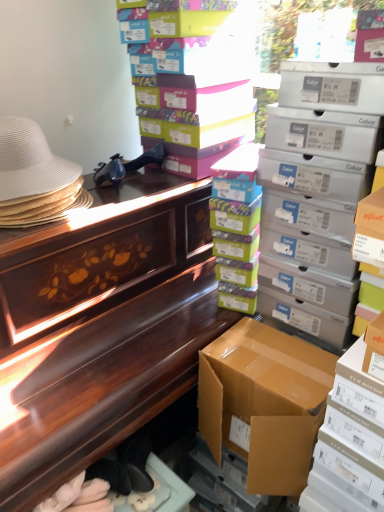
Question: Does multicolored cardboard boxes at center, the 3th box positioned from the top, have a lesser width compared to brown cardboard box at lower right, positioned as the fourth box in top-to-bottom order?

Choices:
 (A) yes
 (B) no

Answer: (A)

Question: From a real-world perspective, is multicolored cardboard boxes at center, the 3th box positioned from the top, over brown cardboard box at lower right, positioned as the fourth box in top-to-bottom order?

Choices:
 (A) no
 (B) yes

Answer: (B)

Question: Would you say multicolored cardboard boxes at center, acting as the 3th box starting from the bottom, is a long distance from brown cardboard box at lower right, positioned as the fourth box in top-to-bottom order?

Choices:
 (A) no
 (B) yes

Answer: (A)

Question: Does multicolored cardboard boxes at center, acting as the 3th box starting from the bottom, have a greater height compared to brown cardboard box at lower right, positioned as the fourth box in top-to-bottom order?

Choices:
 (A) no
 (B) yes

Answer: (B)

Question: Is brown cardboard box at lower right, the 2th box in the bottom-to-top sequence, inside multicolored cardboard boxes at center, acting as the 3th box starting from the bottom?

Choices:
 (A) yes
 (B) no

Answer: (B)

Question: Can you confirm if multicolored cardboard boxes at center, the 3th box positioned from the top, is positioned to the left of brown cardboard box at lower right, the 2th box in the bottom-to-top sequence?

Choices:
 (A) no
 (B) yes

Answer: (B)

Question: Considering the relative sizes of matte cardboard box at upper right, marked as the second box in a top-to-bottom arrangement, and multicolored cardboard boxes at center, acting as the 3th box starting from the bottom, in the image provided, is matte cardboard box at upper right, marked as the second box in a top-to-bottom arrangement, thinner than multicolored cardboard boxes at center, acting as the 3th box starting from the bottom,?

Choices:
 (A) yes
 (B) no

Answer: (B)

Question: Considering the relative positions of matte cardboard box at upper right, which is counted as the 4th box, starting from the bottom, and multicolored cardboard boxes at center, the 3th box positioned from the top, in the image provided, is matte cardboard box at upper right, which is counted as the 4th box, starting from the bottom, to the right of multicolored cardboard boxes at center, the 3th box positioned from the top, from the viewer's perspective?

Choices:
 (A) yes
 (B) no

Answer: (A)

Question: From the image's perspective, is matte cardboard box at upper right, marked as the second box in a top-to-bottom arrangement, above multicolored cardboard boxes at center, the 3th box positioned from the top?

Choices:
 (A) no
 (B) yes

Answer: (B)

Question: Can you confirm if matte cardboard box at upper right, marked as the second box in a top-to-bottom arrangement, is wider than multicolored cardboard boxes at center, the 3th box positioned from the top?

Choices:
 (A) yes
 (B) no

Answer: (A)

Question: From the image's perspective, is matte cardboard box at upper right, which is counted as the 4th box, starting from the bottom, below multicolored cardboard boxes at center, acting as the 3th box starting from the bottom?

Choices:
 (A) no
 (B) yes

Answer: (A)

Question: From a real-world perspective, is matte cardboard box at upper right, marked as the second box in a top-to-bottom arrangement, located beneath multicolored cardboard boxes at center, the 3th box positioned from the top?

Choices:
 (A) yes
 (B) no

Answer: (B)

Question: Does multicolored cardboard boxes at center, the 3th box positioned from the top, appear on the right side of white woven hat at left?

Choices:
 (A) yes
 (B) no

Answer: (A)